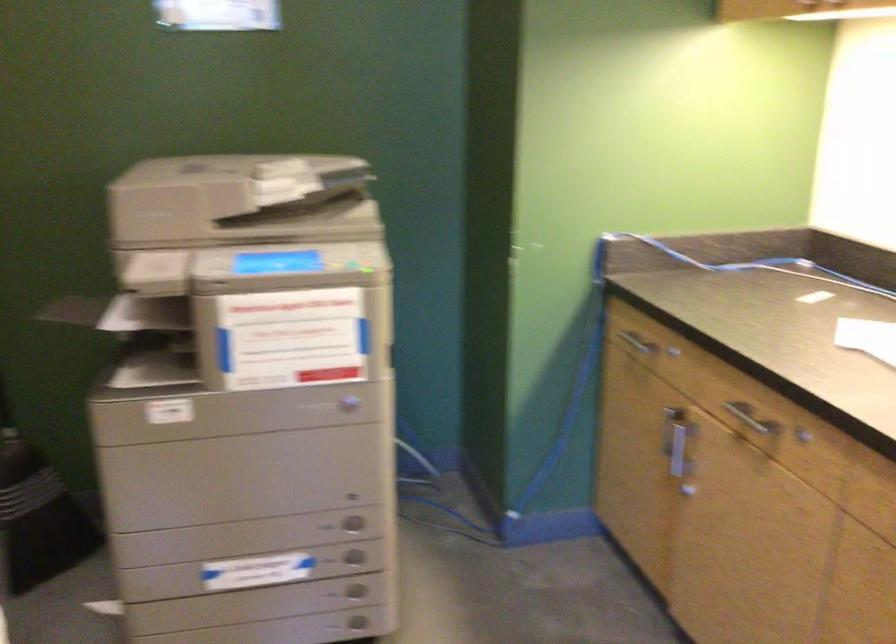
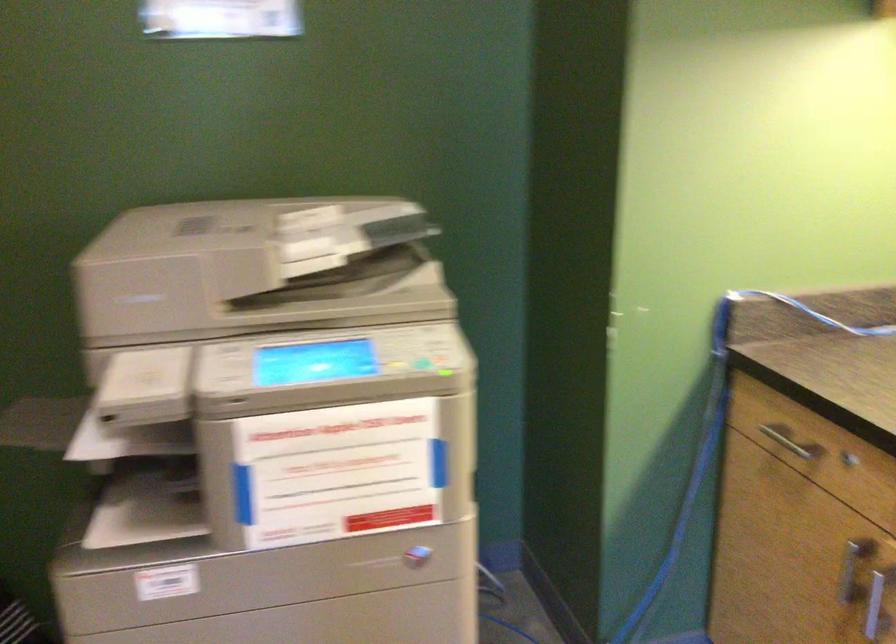
Question: How did the camera likely rotate?

Choices:
 (A) Left
 (B) Right
 (C) Up
 (D) Down

Answer: (C)